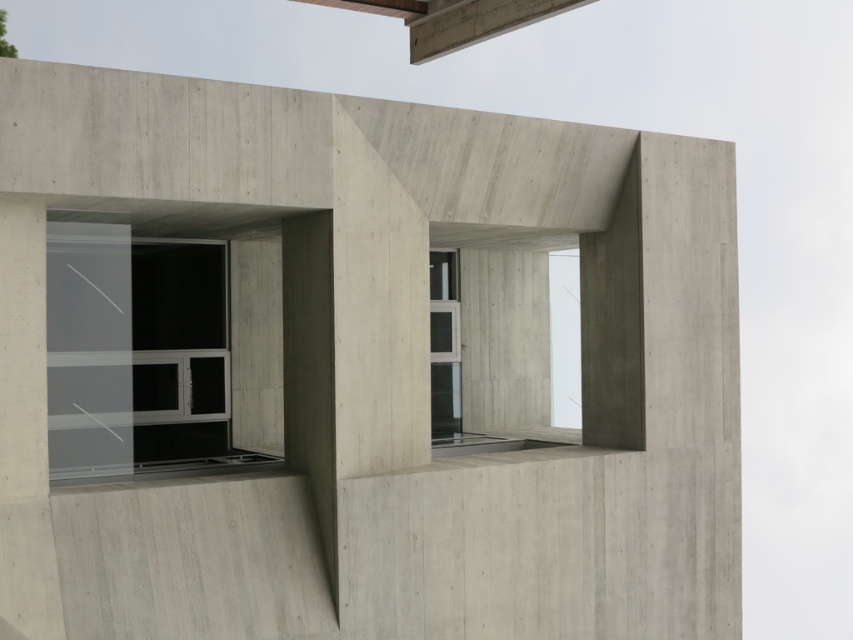
Question: Which point appears closest to the camera in this image?

Choices:
 (A) (169, 308)
 (B) (445, 388)

Answer: (A)

Question: Where is transparent glass window at center located in relation to clear glass window at center in the image?

Choices:
 (A) right
 (B) left

Answer: (B)

Question: Can you confirm if transparent glass window at center is positioned to the left of clear glass window at center?

Choices:
 (A) no
 (B) yes

Answer: (B)

Question: Which point is farther to the camera?

Choices:
 (A) (138, 436)
 (B) (436, 385)

Answer: (B)

Question: Is transparent glass window at center above clear glass window at center?

Choices:
 (A) no
 (B) yes

Answer: (B)